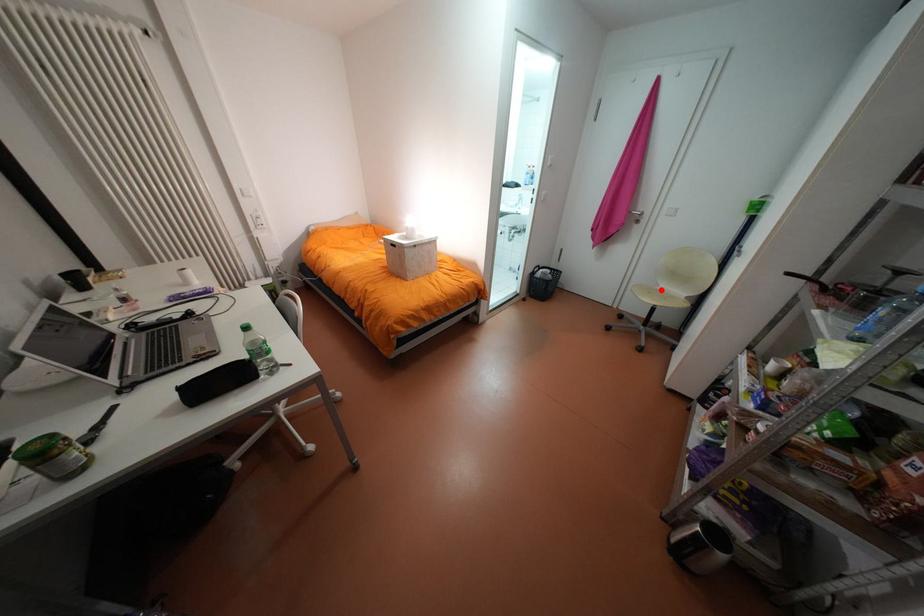
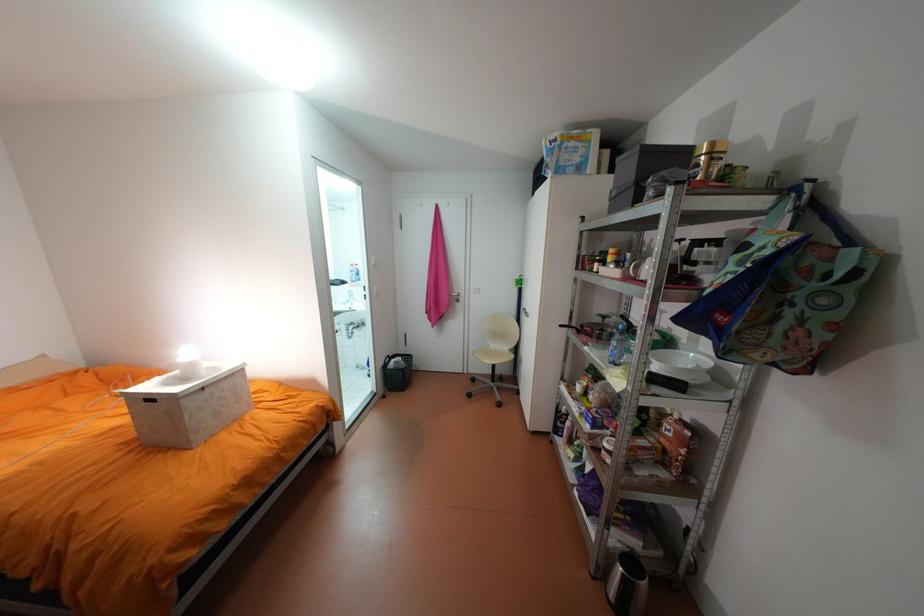
Question: I am providing you with two images of the same scene from different viewpoints. Given a red point in image1, look at the same physical point in image2. Is it:

Choices:
 (A) Closer to the viewpoint
 (B) Farther from the viewpoint

Answer: (B)